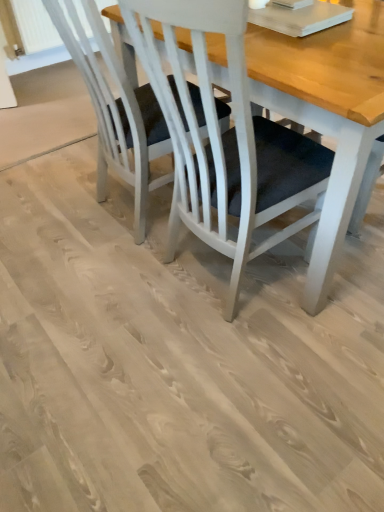
This screenshot has height=512, width=384. I want to click on vacant space in front of wooden table at center, so click(243, 378).